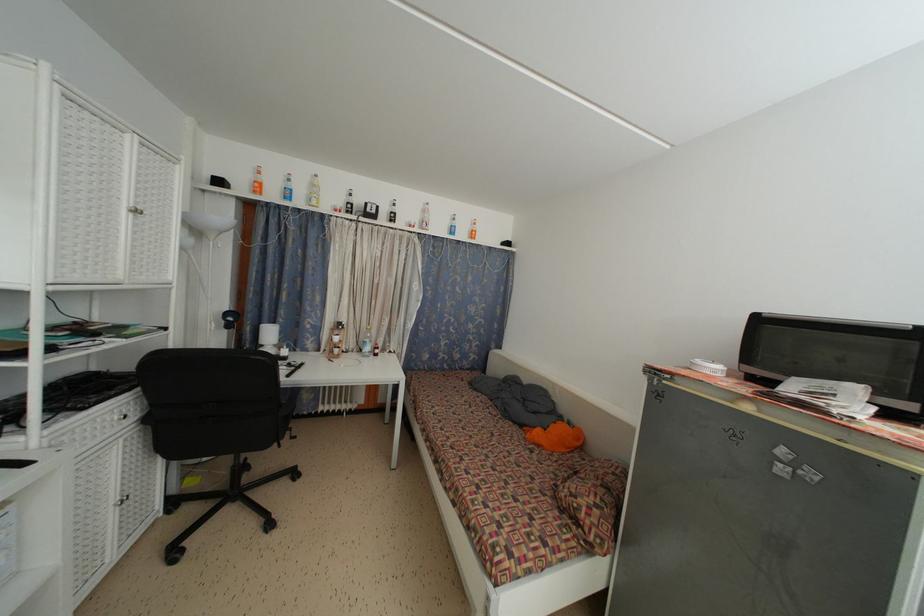
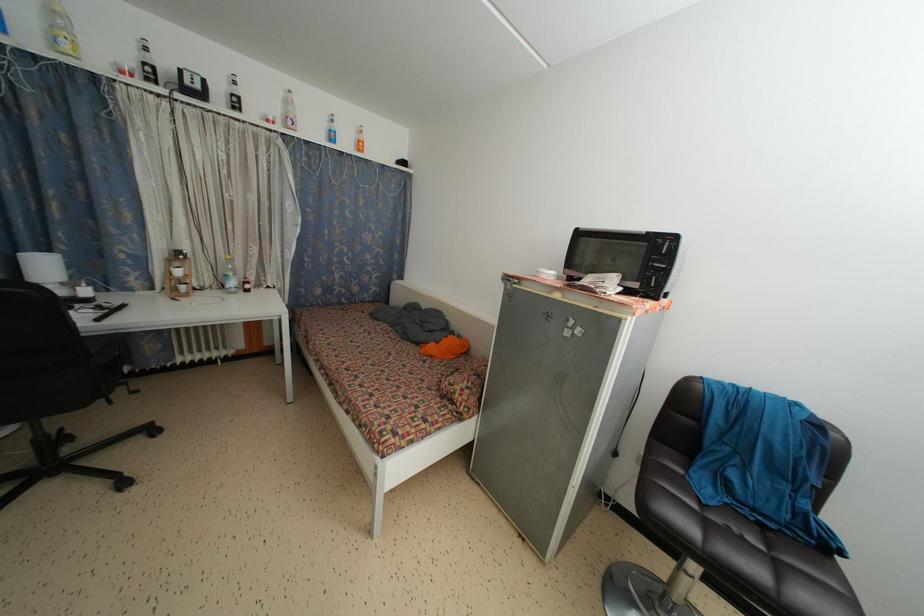
In the second image, find the point that corresponds to pixel 300 397 in the first image.

(127, 345)